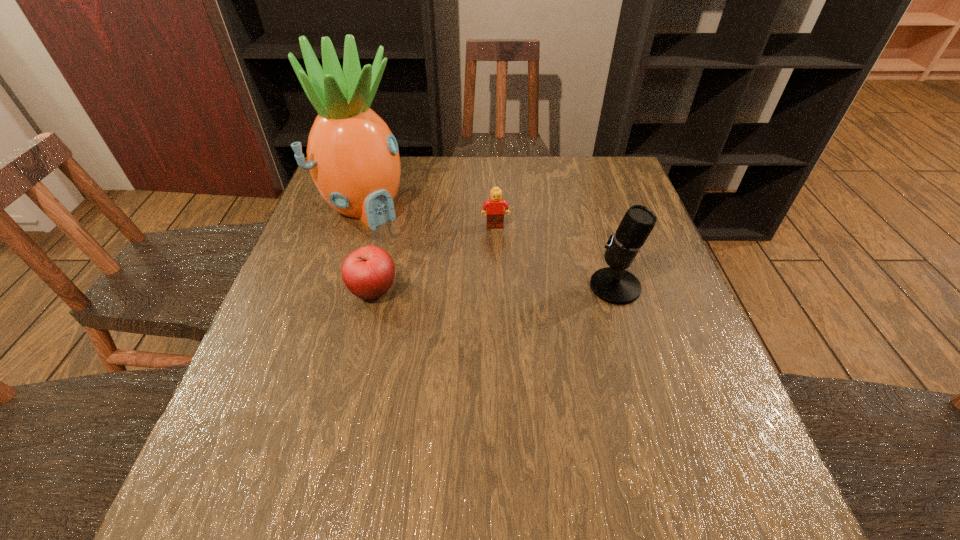
The width and height of the screenshot is (960, 540). What are the coordinates of `object that is the third nearest to the apple` in the screenshot? It's located at (614, 285).

Find the location of `vacant region that satisfies the following two spatial constraints: 1. on the back side of the apple; 2. on the left side of the Lego`. vacant region that satisfies the following two spatial constraints: 1. on the back side of the apple; 2. on the left side of the Lego is located at coordinates (389, 226).

Locate an element on the screen. The width and height of the screenshot is (960, 540). free spot that satisfies the following two spatial constraints: 1. on the front side of the third object from left to right; 2. on the right side of the microphone is located at coordinates (497, 287).

This screenshot has height=540, width=960. Identify the location of blank space that satisfies the following two spatial constraints: 1. on the back side of the third shortest object; 2. on the right side of the apple. (374, 287).

This screenshot has width=960, height=540. Find the location of `vacant space that satisfies the following two spatial constraints: 1. on the front side of the apple; 2. on the right side of the tallest object`. vacant space that satisfies the following two spatial constraints: 1. on the front side of the apple; 2. on the right side of the tallest object is located at coordinates (338, 291).

Where is `free space that satisfies the following two spatial constraints: 1. on the back side of the Lego; 2. on the right side of the apple`? The image size is (960, 540). free space that satisfies the following two spatial constraints: 1. on the back side of the Lego; 2. on the right side of the apple is located at coordinates (389, 226).